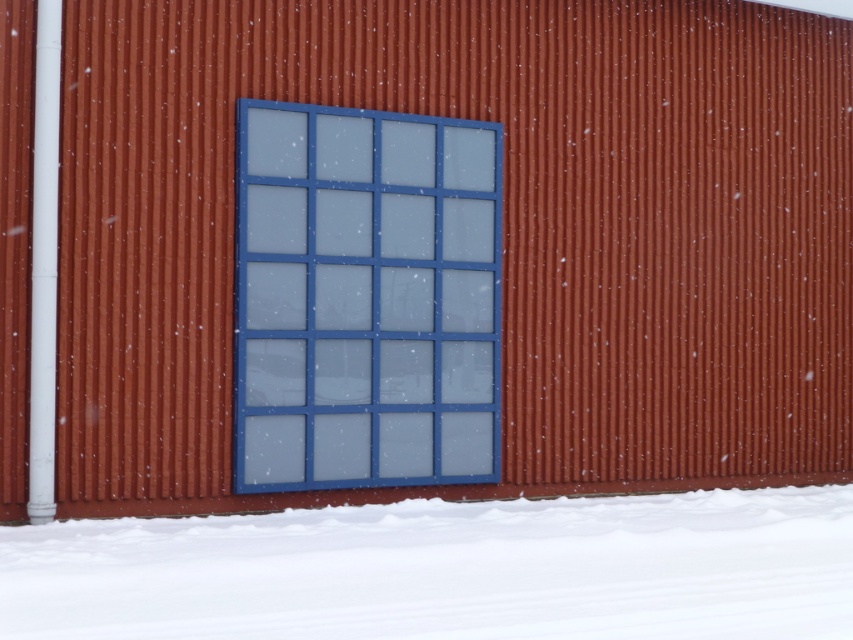
Question: Does white powdery snow at lower center have a smaller size compared to blue glass window at center?

Choices:
 (A) yes
 (B) no

Answer: (A)

Question: Which point is closer to the camera taking this photo?

Choices:
 (A) (312, 220)
 (B) (751, 512)

Answer: (A)

Question: Can you confirm if white powdery snow at lower center is positioned to the left of blue glass window at center?

Choices:
 (A) yes
 (B) no

Answer: (B)

Question: Can you confirm if white powdery snow at lower center is smaller than blue glass window at center?

Choices:
 (A) yes
 (B) no

Answer: (A)